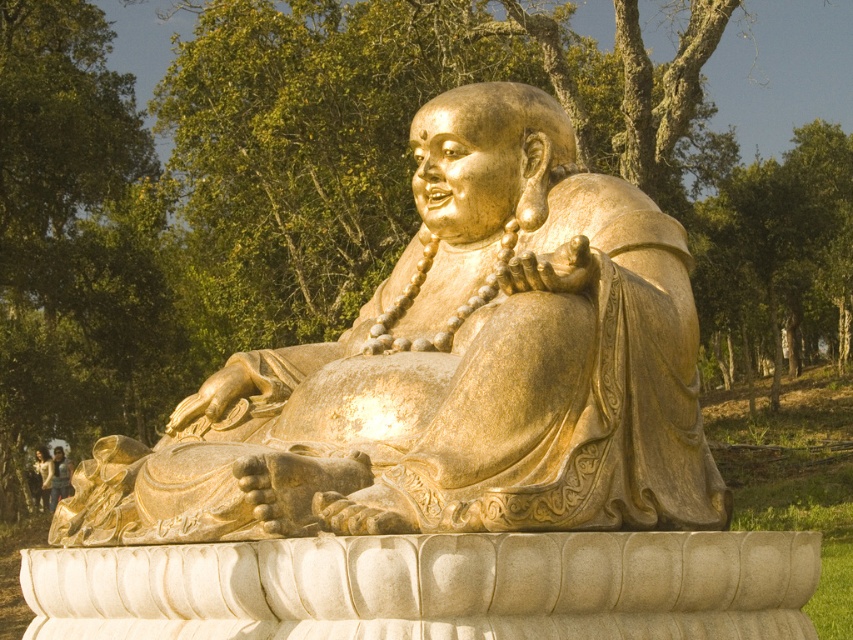
You are a photographer planning to capture the golden statue at center and the light brown leather jacket at lower left in a single frame. Based on their sizes, which object should you focus on first to ensure both are in the frame without cropping?

The golden statue at center is not as tall as the light brown leather jacket at lower left, so you should focus on the light brown leather jacket at lower left first to ensure both fit in the frame.

You are a photographer wanting to capture both the gold polished statue at center and the light brown leather jacket at lower left in the same frame. Based on their positions, which object should you focus on first to ensure both are in the frame?

The gold polished statue at center is located above the light brown leather jacket at lower left, so you should focus on the light brown leather jacket at lower left first to ensure both are in the frame.